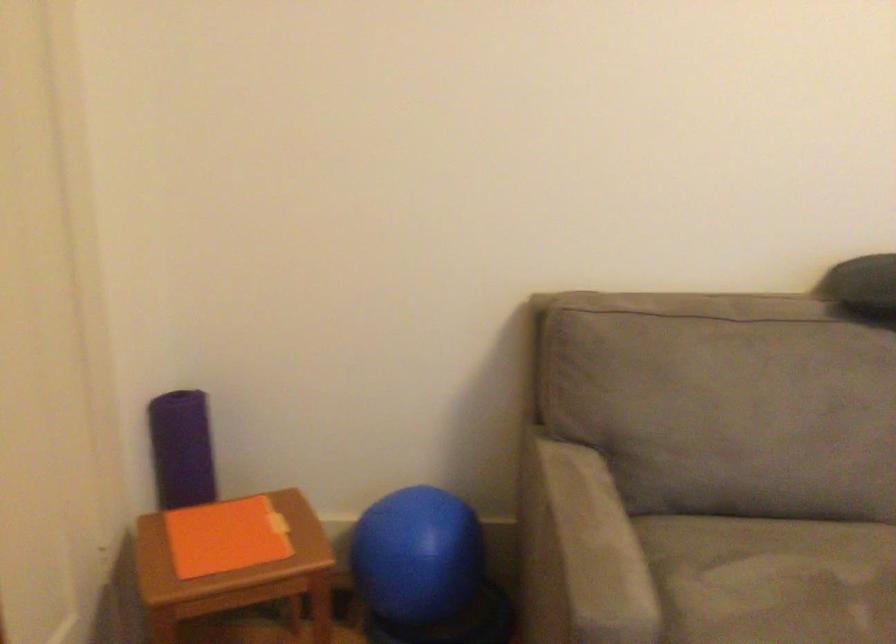
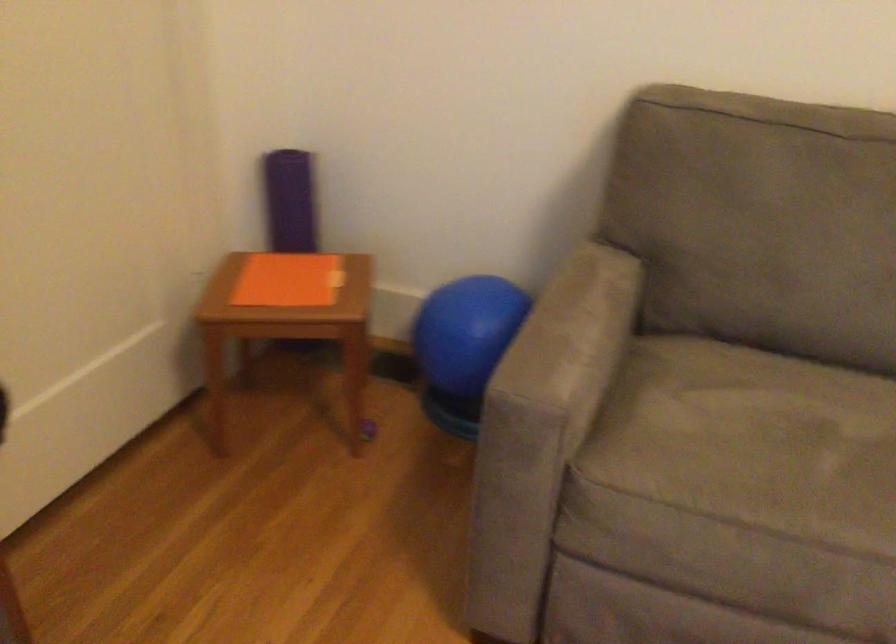
Locate, in the second image, the point that corresponds to (x=606, y=541) in the first image.

(572, 333)